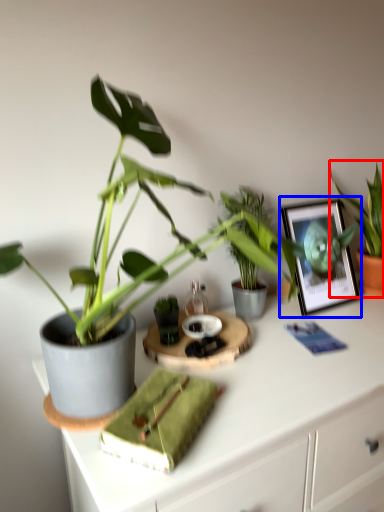
Question: Which of the following is the farthest to the observer, houseplant (highlighted by a red box) or picture frame (highlighted by a blue box)?

Choices:
 (A) houseplant
 (B) picture frame

Answer: (A)